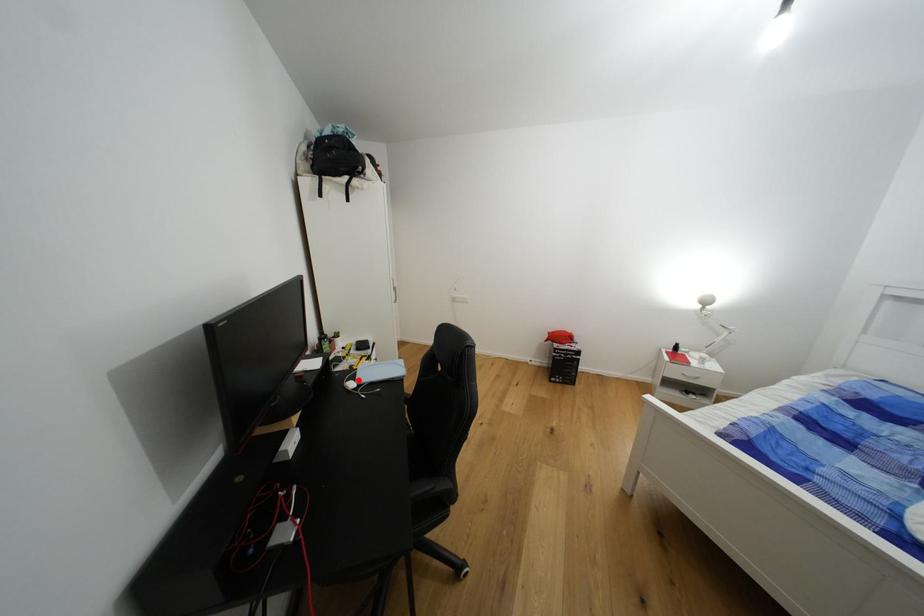
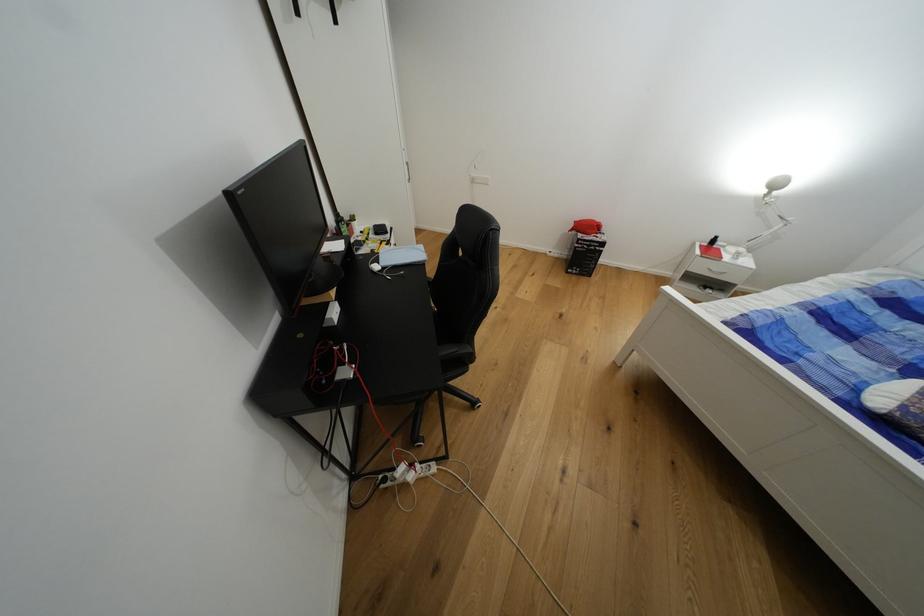
In the second image, find the point that corresponds to the highlighted location in the first image.

(383, 262)